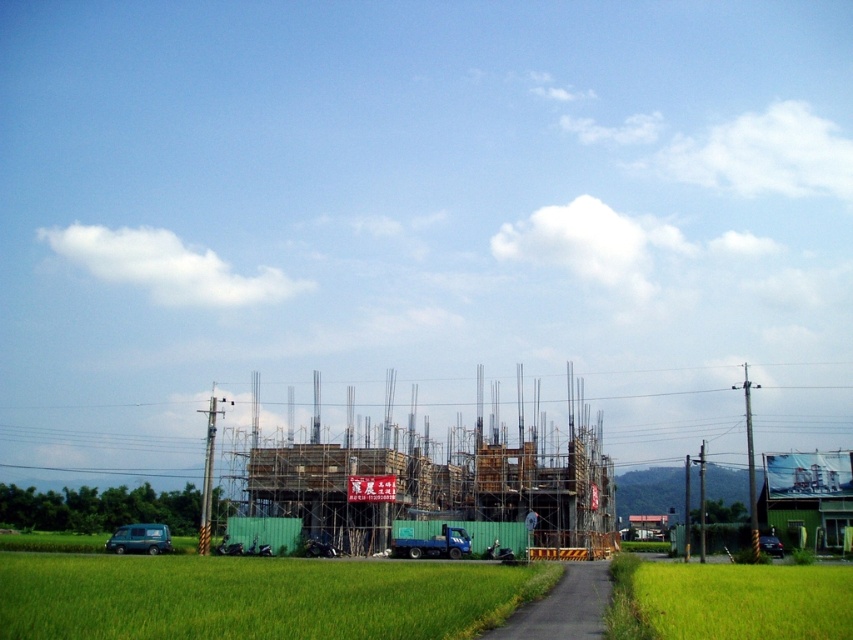
You are a construction worker standing at the entrance of the construction site. You need to walk to the green grass at lower left to retrieve a tool you dropped there. However, there is wooden scaffolding at center blocking your path. Can you walk around the scaffolding to reach the grass?

The green grass at lower left is in front of wooden scaffolding at center, so the scaffolding is between you and the grass. Since the scaffolding is blocking your path, you cannot walk around it to reach the grass.

You are a construction worker standing at the entrance of the construction site. You need to locate the wooden scaffolding at center. Based on the coordinates provided, where should you look relative to the red banner with Chinese characters?

The wooden scaffolding at center is located at coordinates point (x=438, y=490). Since the red banner is at the entrance, you should look towards the center area of the construction site to find the wooden scaffolding at center.